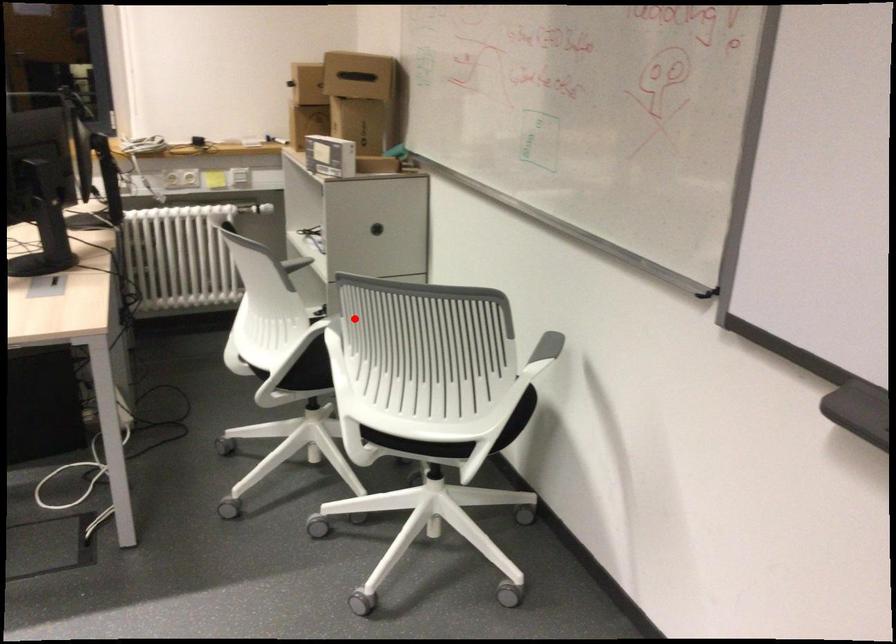
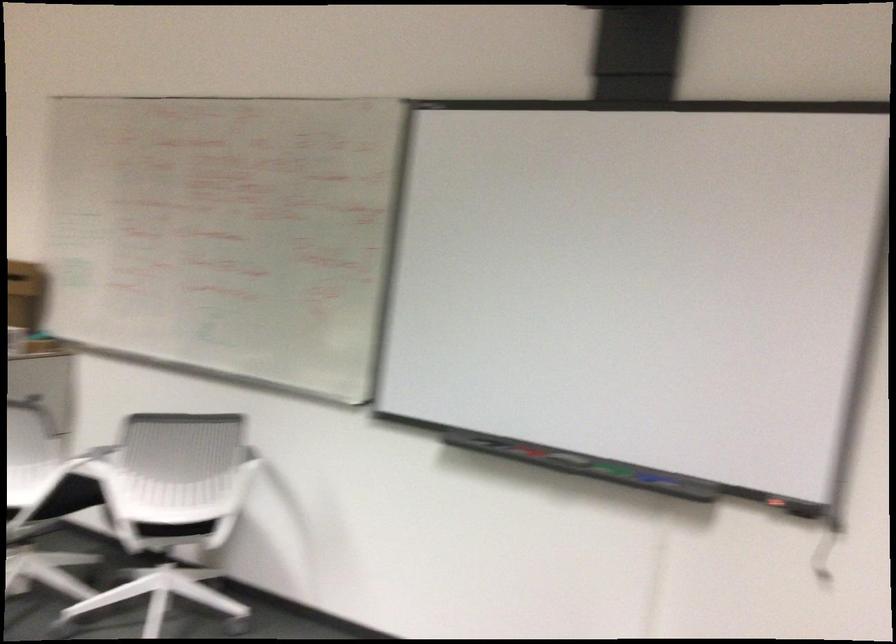
Question: I am providing you with two images of the same scene from different viewpoints. A red point is marked on the first image. At the location where the point appears in image 1, is it still visible in image 2?

Choices:
 (A) Yes
 (B) No

Answer: (A)